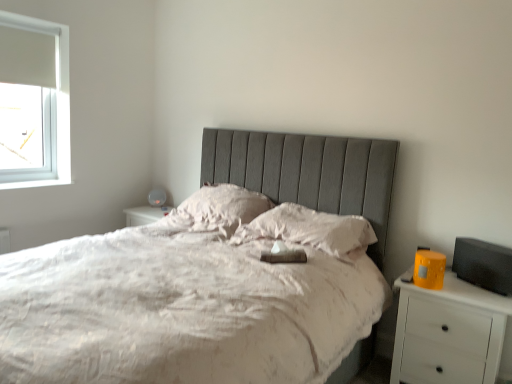
Question: Is white soft pillow at center, which ranks as the 1th pillow in left-to-right order, in contact with white matte nightstand at right?

Choices:
 (A) yes
 (B) no

Answer: (B)

Question: Does white soft pillow at center, which ranks as the 1th pillow in left-to-right order, have a lesser height compared to white matte nightstand at right?

Choices:
 (A) yes
 (B) no

Answer: (A)

Question: Is white soft pillow at center, which ranks as the 1th pillow in left-to-right order, located outside white matte nightstand at right?

Choices:
 (A) no
 (B) yes

Answer: (B)

Question: Is white soft pillow at center, which ranks as the 1th pillow in left-to-right order, to the left of white matte nightstand at right from the viewer's perspective?

Choices:
 (A) no
 (B) yes

Answer: (B)

Question: Is white soft pillow at center, acting as the 2th pillow starting from the right, bigger than white matte nightstand at right?

Choices:
 (A) no
 (B) yes

Answer: (A)

Question: Does white soft pillow at center, which ranks as the 1th pillow in left-to-right order, turn towards white matte nightstand at right?

Choices:
 (A) yes
 (B) no

Answer: (B)

Question: Does silky white pillow at center, placed as the 2th pillow when sorted from left to right, have a greater height compared to white soft pillow at center, which ranks as the 1th pillow in left-to-right order?

Choices:
 (A) no
 (B) yes

Answer: (A)

Question: Is silky white pillow at center, placed as the 2th pillow when sorted from left to right, wider than white soft pillow at center, which ranks as the 1th pillow in left-to-right order?

Choices:
 (A) no
 (B) yes

Answer: (A)

Question: Is silky white pillow at center, which appears as the 1th pillow when viewed from the right, positioned with its back to white soft pillow at center, acting as the 2th pillow starting from the right?

Choices:
 (A) yes
 (B) no

Answer: (B)

Question: Is the surface of silky white pillow at center, placed as the 2th pillow when sorted from left to right, in direct contact with white soft pillow at center, which ranks as the 1th pillow in left-to-right order?

Choices:
 (A) no
 (B) yes

Answer: (A)

Question: From the image's perspective, does silky white pillow at center, which appears as the 1th pillow when viewed from the right, appear higher than white soft pillow at center, which ranks as the 1th pillow in left-to-right order?

Choices:
 (A) no
 (B) yes

Answer: (A)

Question: Is silky white pillow at center, placed as the 2th pillow when sorted from left to right, closer to camera compared to white soft pillow at center, which ranks as the 1th pillow in left-to-right order?

Choices:
 (A) yes
 (B) no

Answer: (A)

Question: From a real-world perspective, does white matte nightstand at right sit lower than silky white pillow at center, placed as the 2th pillow when sorted from left to right?

Choices:
 (A) yes
 (B) no

Answer: (A)